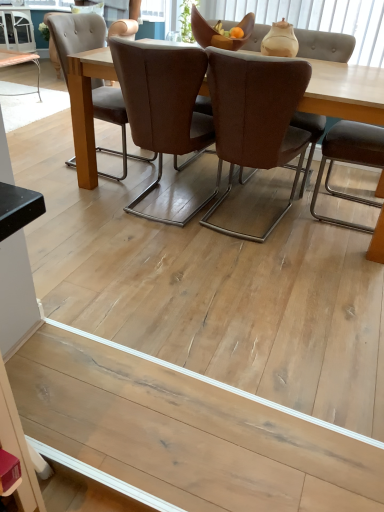
Where is `vacant space to the right of brown fabric chair at center, which appears as the second chair when viewed from the left`? This screenshot has width=384, height=512. vacant space to the right of brown fabric chair at center, which appears as the second chair when viewed from the left is located at coordinates (317, 230).